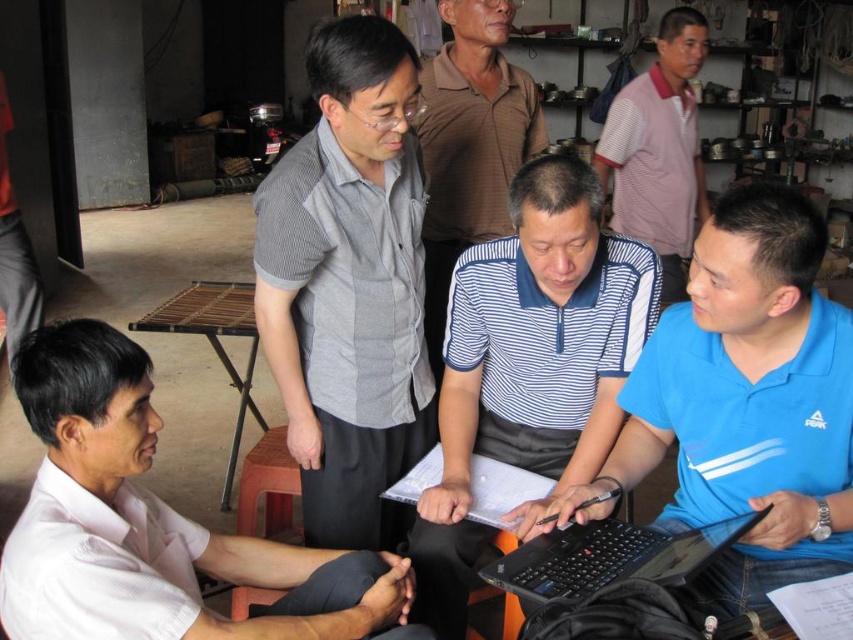
Between blue polyester shirt at center and gray striped shirt at upper center, which one is positioned higher?

Positioned higher is gray striped shirt at upper center.

In the scene shown: Who is positioned more to the right, blue polyester shirt at center or gray striped shirt at upper center?

Positioned to the right is blue polyester shirt at center.

This screenshot has height=640, width=853. Describe the element at coordinates (746, 404) in the screenshot. I see `blue polyester shirt at center` at that location.

Find the location of a particular element. This screenshot has height=640, width=853. blue polyester shirt at center is located at coordinates coord(746,404).

Which of these two, gray striped shirt at upper center or striped cotton shirt at center, stands shorter?

With less height is striped cotton shirt at center.

Is point (376, 156) in front of point (459, 212)?

Yes, it is in front of point (459, 212).

Who is more forward, (379, 148) or (502, 224)?

Point (379, 148)

Locate an element on the screen. Image resolution: width=853 pixels, height=640 pixels. gray striped shirt at upper center is located at coordinates (349, 285).

Can you confirm if blue polyester shirt at center is positioned below striped polo shirt at center?

Yes.

In the scene shown: Is blue polyester shirt at center smaller than striped polo shirt at center?

Yes.

Is point (828, 404) positioned before point (695, 29)?

Yes, it is.

Where is `blue polyester shirt at center`? blue polyester shirt at center is located at coordinates (746, 404).